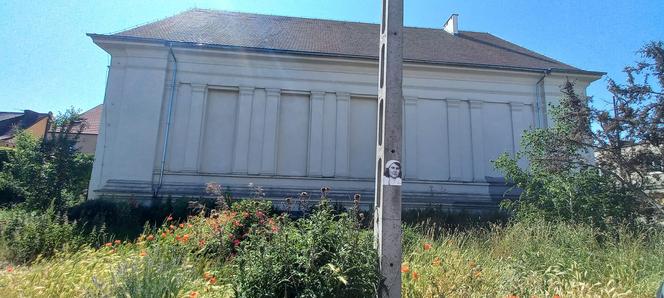
You are a GUI agent. You are given a task and a screenshot of the screen. Output one action in this format:
    pyautogui.click(x=<x>, y=<y>)
    Task: Click on the white wall
    The width and height of the screenshot is (664, 298).
    Given the screenshot: What is the action you would take?
    pyautogui.click(x=139, y=106), pyautogui.click(x=325, y=121), pyautogui.click(x=463, y=119)